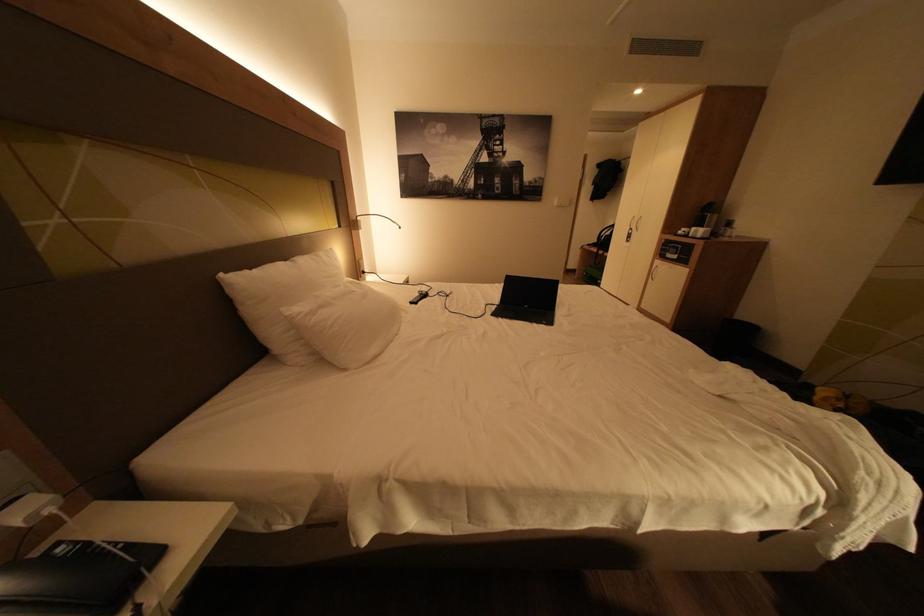
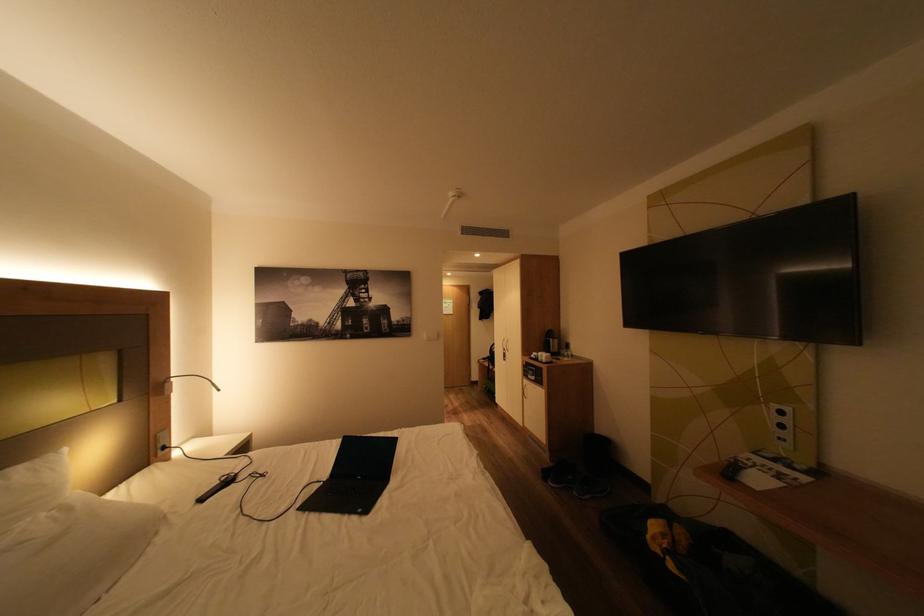
The point at (850, 406) is marked in the first image. Where is the corresponding point in the second image?

(675, 546)